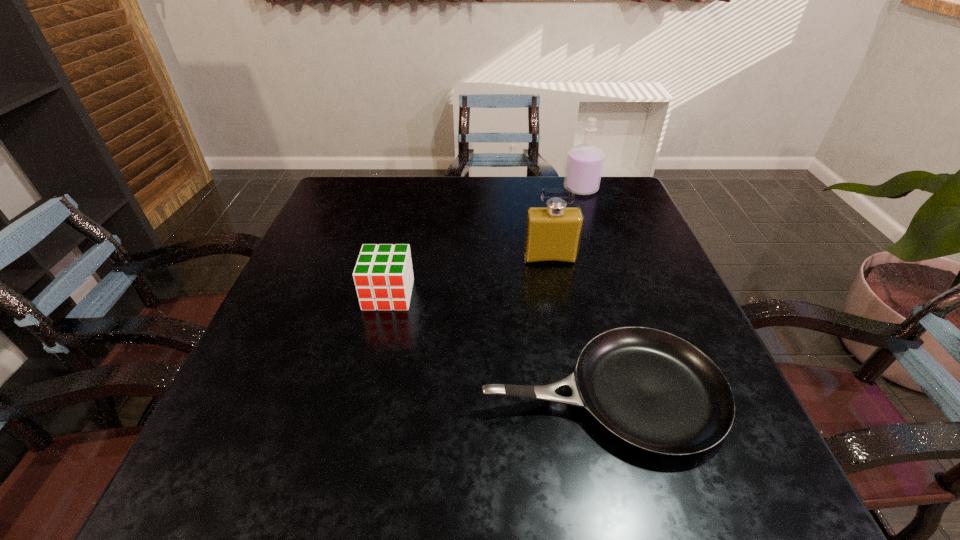
Identify the location of the farther perfume. (584, 166).

You are a GUI agent. You are given a task and a screenshot of the screen. Output one action in this format:
    pyautogui.click(x=<x>, y=<y>)
    Task: Click on the right perfume
    
    Given the screenshot: What is the action you would take?
    pyautogui.click(x=584, y=166)

Where is `the second farthest object`? The height and width of the screenshot is (540, 960). the second farthest object is located at coordinates (553, 233).

Image resolution: width=960 pixels, height=540 pixels. Find the location of `the second tallest object`. the second tallest object is located at coordinates (553, 233).

What are the coordinates of `the second shortest object` in the screenshot? It's located at (383, 275).

In order to click on the leftmost object in this screenshot , I will do `click(383, 275)`.

Where is `pan`? This screenshot has width=960, height=540. pan is located at coordinates (655, 391).

This screenshot has height=540, width=960. What are the coordinates of `the shortest object` in the screenshot? It's located at (655, 391).

Find the location of a particular element. The width and height of the screenshot is (960, 540). vacant area situated 0.400m on the left of the farther perfume is located at coordinates (427, 189).

Where is `vacant space located on the front-facing side of the nearer perfume`? This screenshot has width=960, height=540. vacant space located on the front-facing side of the nearer perfume is located at coordinates (555, 288).